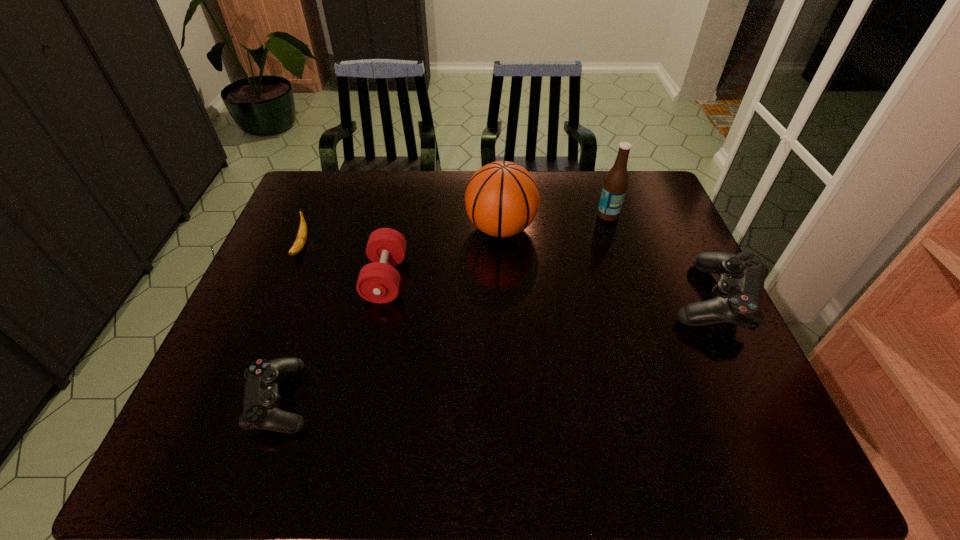
This screenshot has height=540, width=960. What are the coordinates of `the fifth object from right to left` in the screenshot? It's located at pyautogui.click(x=261, y=401).

This screenshot has width=960, height=540. What are the coordinates of `the nearer control` in the screenshot? It's located at (261, 401).

Locate an element on the screen. Image resolution: width=960 pixels, height=540 pixels. the rightmost object is located at coordinates (738, 295).

Where is `the farther control`? The image size is (960, 540). the farther control is located at coordinates (738, 295).

You are a GUI agent. You are given a task and a screenshot of the screen. Output one action in this format:
    pyautogui.click(x=<x>, y=<y>)
    Task: Click on the second object from right to left
    
    Given the screenshot: What is the action you would take?
    pyautogui.click(x=615, y=185)

Where is `banana`? banana is located at coordinates (299, 243).

Where is `basketball`? Image resolution: width=960 pixels, height=540 pixels. basketball is located at coordinates (502, 198).

Locate an element on the screen. The width and height of the screenshot is (960, 540). dumbbell is located at coordinates (378, 282).

Where is `vacant area located on the right of the nearer control`? This screenshot has width=960, height=540. vacant area located on the right of the nearer control is located at coordinates (453, 399).

Locate an element on the screen. vacant space located 0.080m on the left of the taller control is located at coordinates (636, 299).